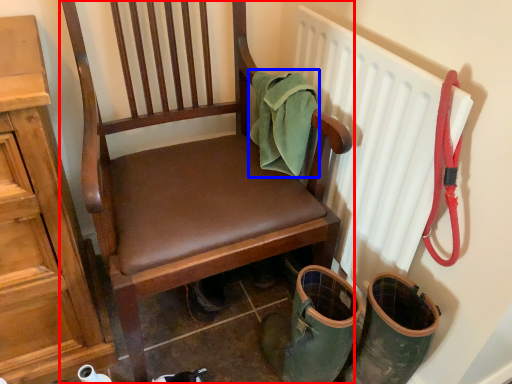
Question: Among these objects, which one is nearest to the camera, chair (highlighted by a red box) or material (highlighted by a blue box)?

Choices:
 (A) chair
 (B) material

Answer: (A)